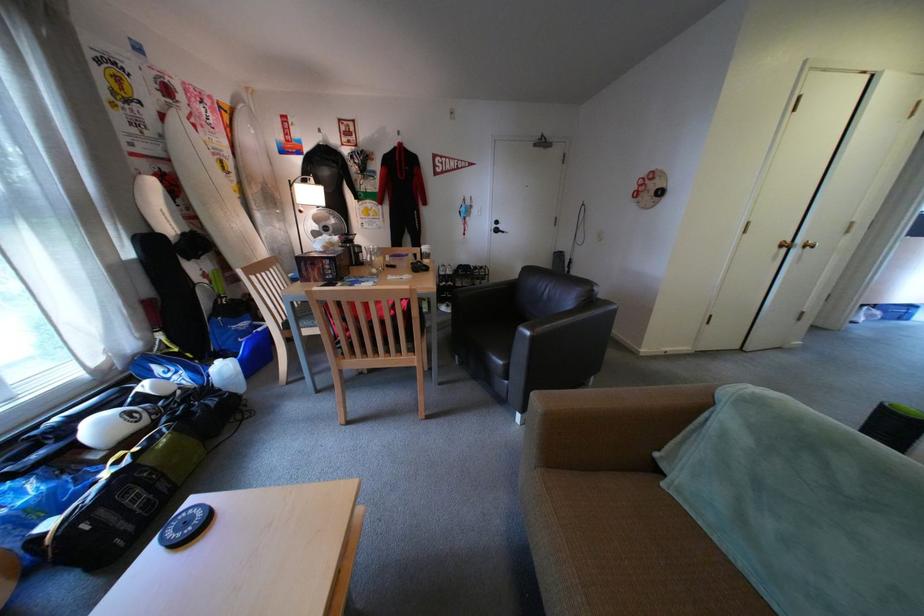
The height and width of the screenshot is (616, 924). What do you see at coordinates (610, 424) in the screenshot?
I see `the sofa armrest` at bounding box center [610, 424].